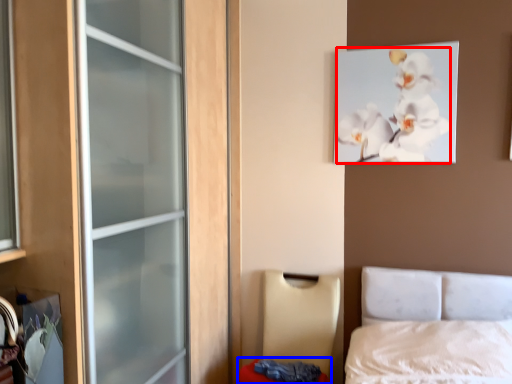
Question: Which object is further to the camera taking this photo, flower (highlighted by a red box) or mattress (highlighted by a blue box)?

Choices:
 (A) flower
 (B) mattress

Answer: (A)